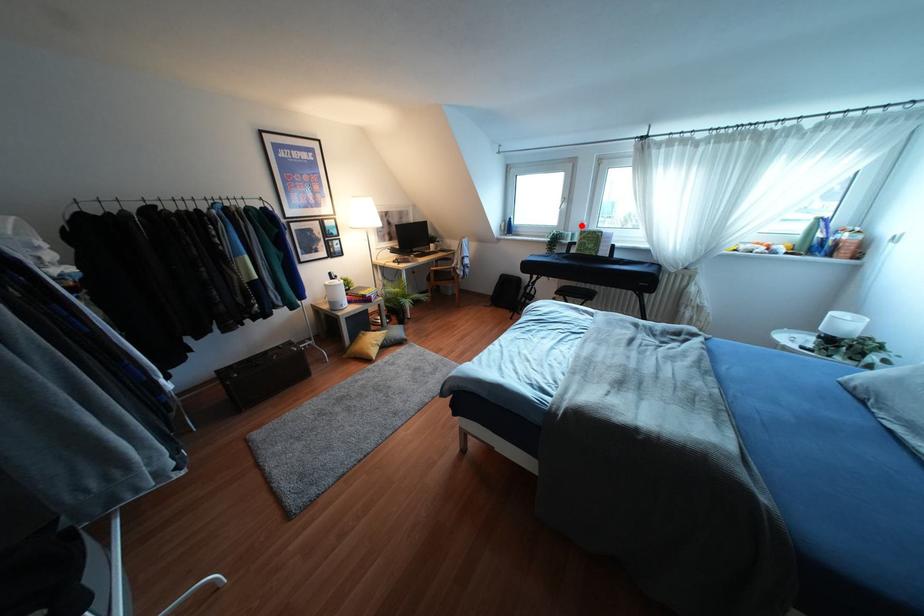
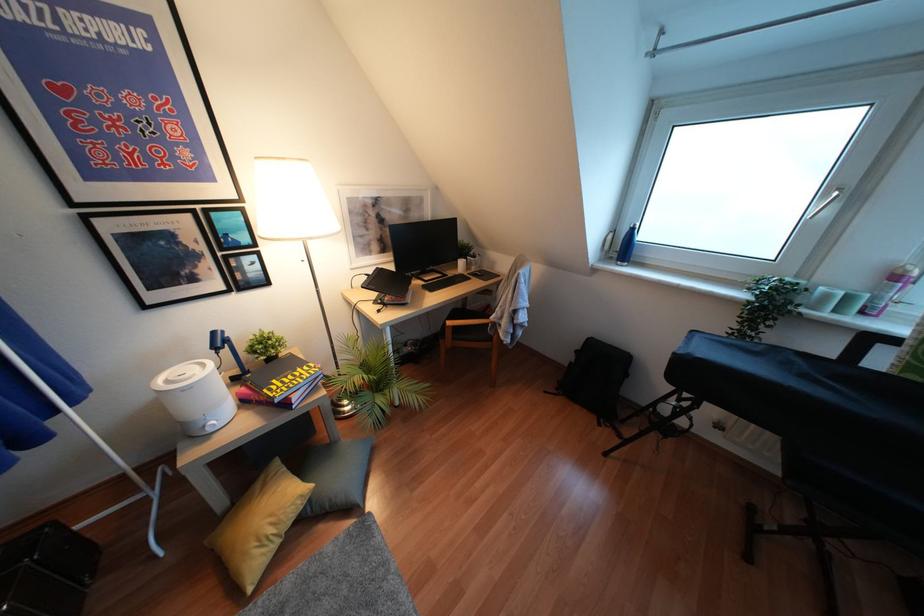
The point at the highlighted location is marked in the first image. Where is the corresponding point in the second image?

(895, 277)